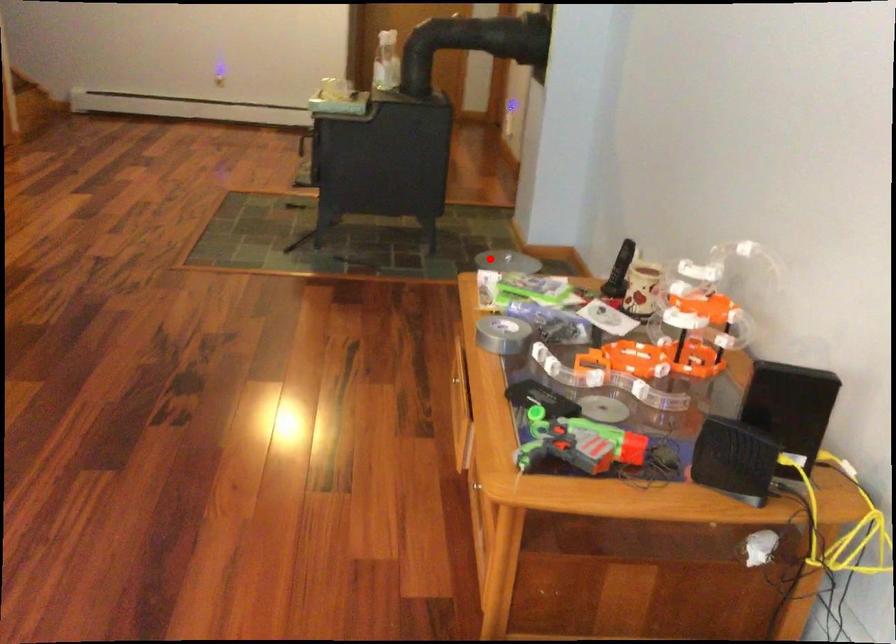
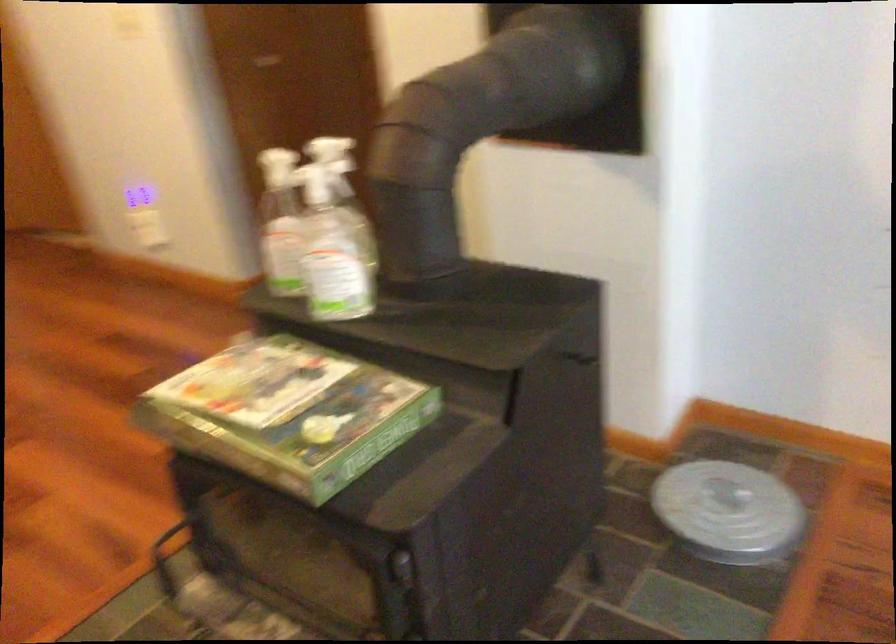
Question: A red point is marked in image1. In image2, is the corresponding 3D point closer to the camera or farther? Reply with the corresponding letter.

Choices:
 (A) The corresponding 3D point is closer.
 (B) The corresponding 3D point is farther.

Answer: (A)